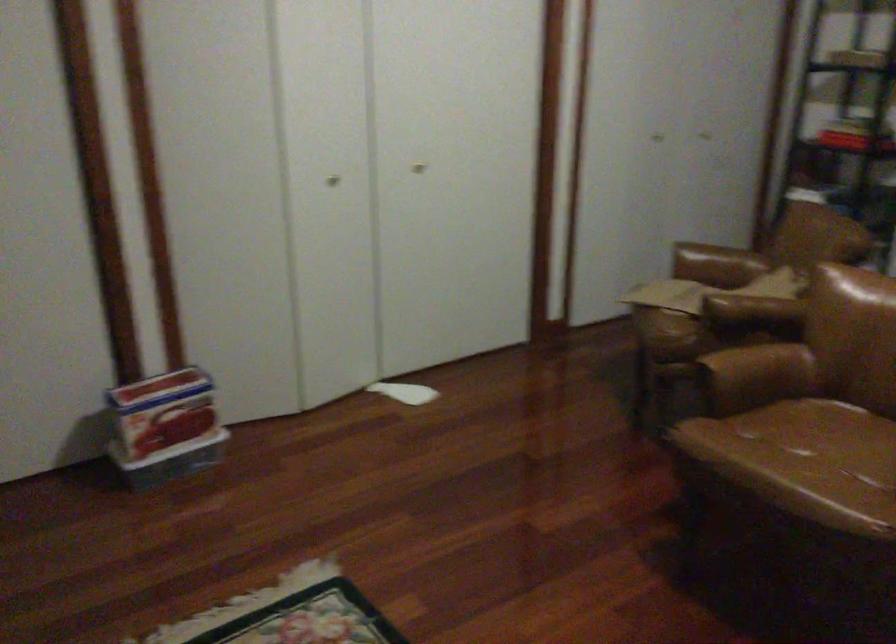
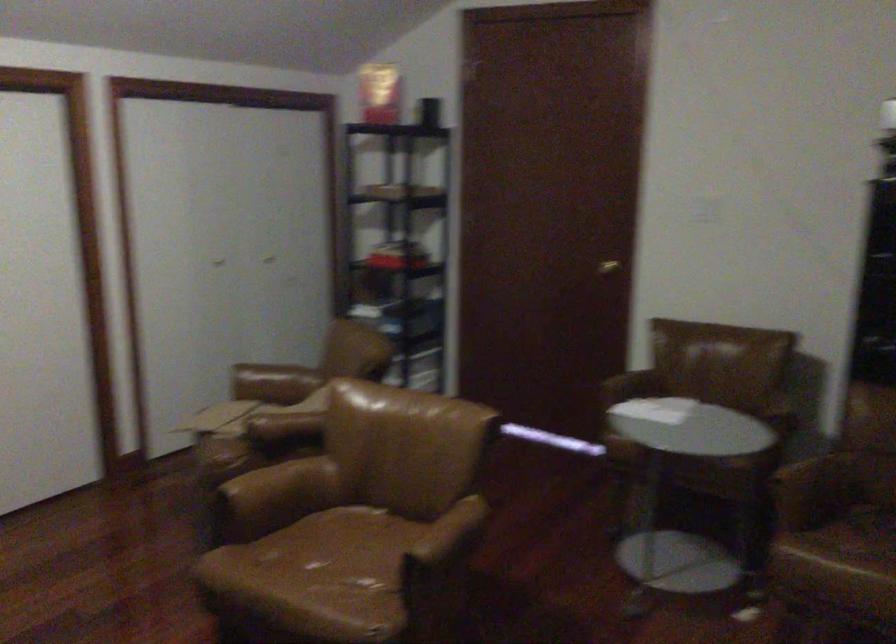
Question: I am providing you with two images of the same scene from different viewpoints. After the viewpoint changes to image2, which objects are now occluded?

Choices:
 (A) gold door handle
 (B) brown chair armrest
 (C) brown chair sitting surface
 (D) none of these

Answer: (D)